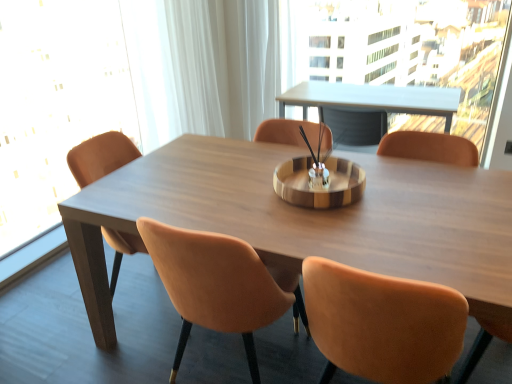
Find the location of a particular element. The width and height of the screenshot is (512, 384). vacant region to the left of matte brown chair at center is located at coordinates (125, 352).